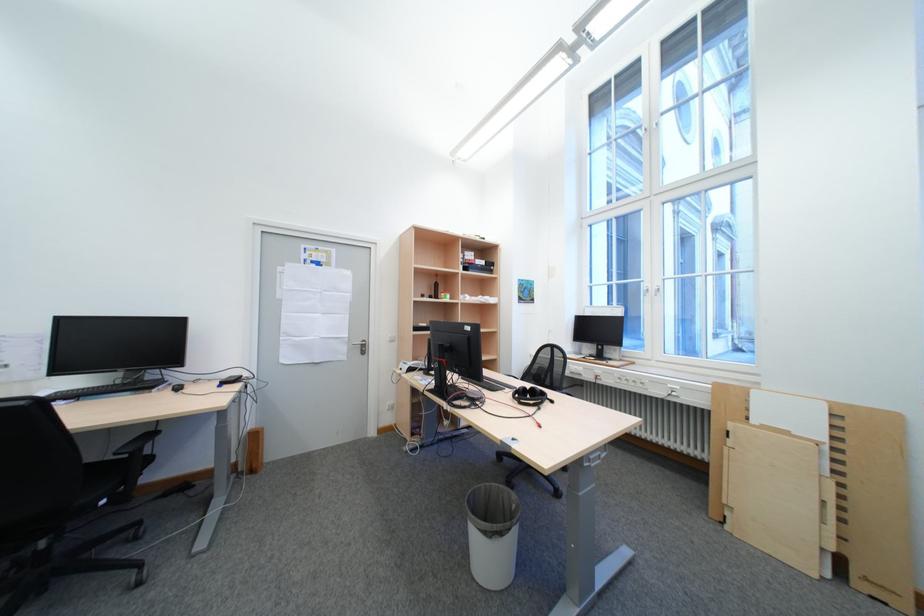
The width and height of the screenshot is (924, 616). Find the location of `black bottle`. black bottle is located at coordinates (435, 286).